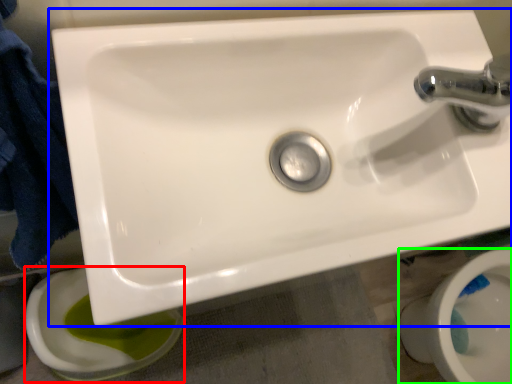
Question: Which object is the closest to the toilet bowl (highlighted by a red box)? Choose among these: sink (highlighted by a blue box) or toilet bowl (highlighted by a green box).

Choices:
 (A) sink
 (B) toilet bowl

Answer: (A)